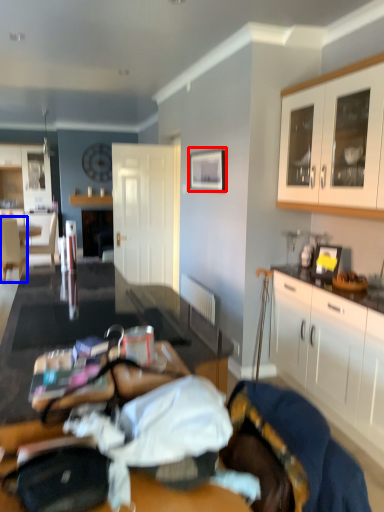
Question: Which object appears closest to the camera in this image, picture frame (highlighted by a red box) or chair (highlighted by a blue box)?

Choices:
 (A) picture frame
 (B) chair

Answer: (A)